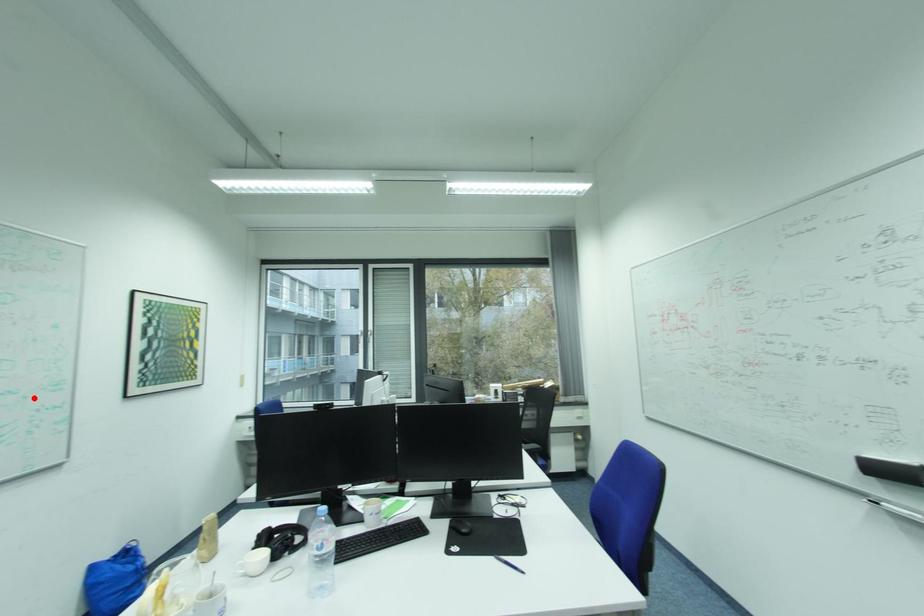
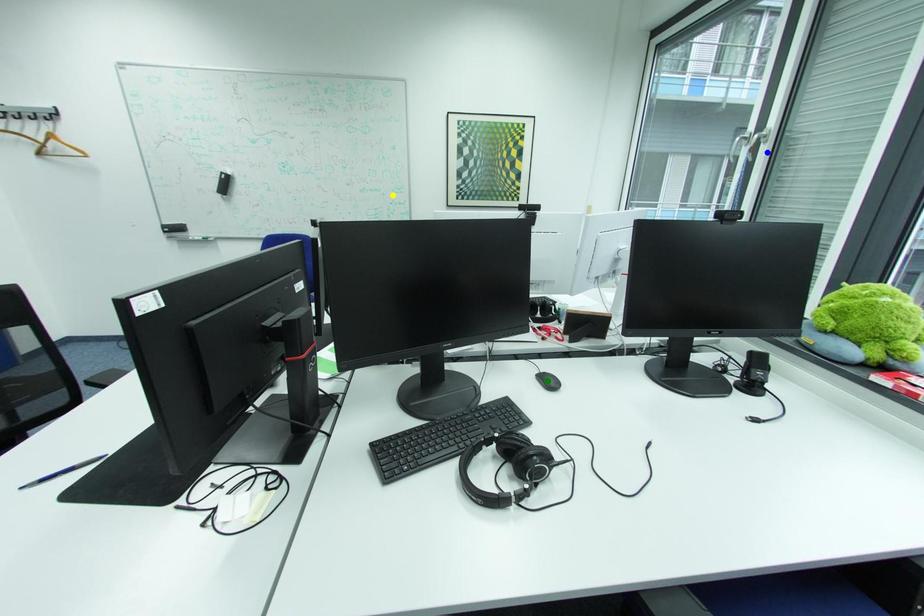
Question: I am providing you with two images of the same scene from different viewpoints. A red point is marked on the first image. You are given multiple points on the second image. Which mark in image 2 goes with the point in image 1?

Choices:
 (A) yellow point
 (B) green point
 (C) blue point

Answer: (A)